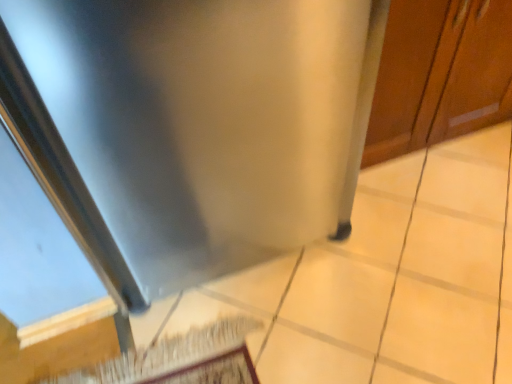
Question: Considering the positions of point (500, 67) and point (262, 196), is point (500, 67) closer or farther from the camera than point (262, 196)?

Choices:
 (A) farther
 (B) closer

Answer: (A)

Question: In the image, is stainless steel refrigerator at center on the left side or the right side of stainless steel at lower right?

Choices:
 (A) right
 (B) left

Answer: (A)

Question: From the image's perspective, is stainless steel refrigerator at center positioned above or below stainless steel at lower right?

Choices:
 (A) below
 (B) above

Answer: (B)

Question: Is point (231, 19) positioned closer to the camera than point (446, 14)?

Choices:
 (A) closer
 (B) farther

Answer: (A)

Question: Is stainless steel at lower right situated inside stainless steel refrigerator at center or outside?

Choices:
 (A) outside
 (B) inside

Answer: (A)

Question: In terms of width, does stainless steel at lower right look wider or thinner when compared to stainless steel refrigerator at center?

Choices:
 (A) wide
 (B) thin

Answer: (A)

Question: From the image's perspective, relative to stainless steel refrigerator at center, is stainless steel at lower right above or below?

Choices:
 (A) above
 (B) below

Answer: (B)